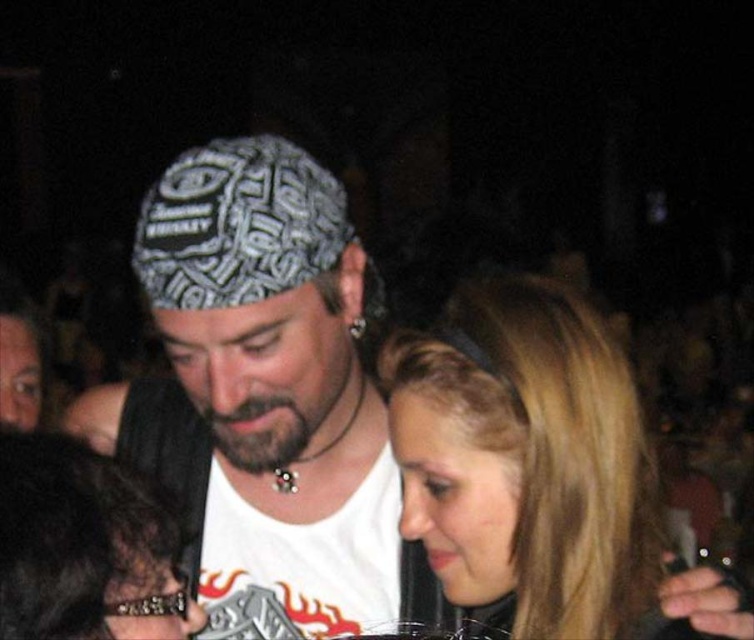
Question: Can you confirm if white printed t-shirt at center is wider than blonde hair at center?

Choices:
 (A) yes
 (B) no

Answer: (A)

Question: Which point is farther from the camera taking this photo?

Choices:
 (A) (608, 547)
 (B) (253, 404)

Answer: (B)

Question: Can you confirm if white printed t-shirt at center is thinner than blonde hair at center?

Choices:
 (A) yes
 (B) no

Answer: (B)

Question: Which point appears closest to the camera in this image?

Choices:
 (A) (428, 513)
 (B) (287, 570)

Answer: (A)

Question: Is white printed t-shirt at center behind blonde hair at center?

Choices:
 (A) yes
 (B) no

Answer: (A)

Question: Which of the following is the farthest from the observer?

Choices:
 (A) (210, 193)
 (B) (497, 513)

Answer: (A)